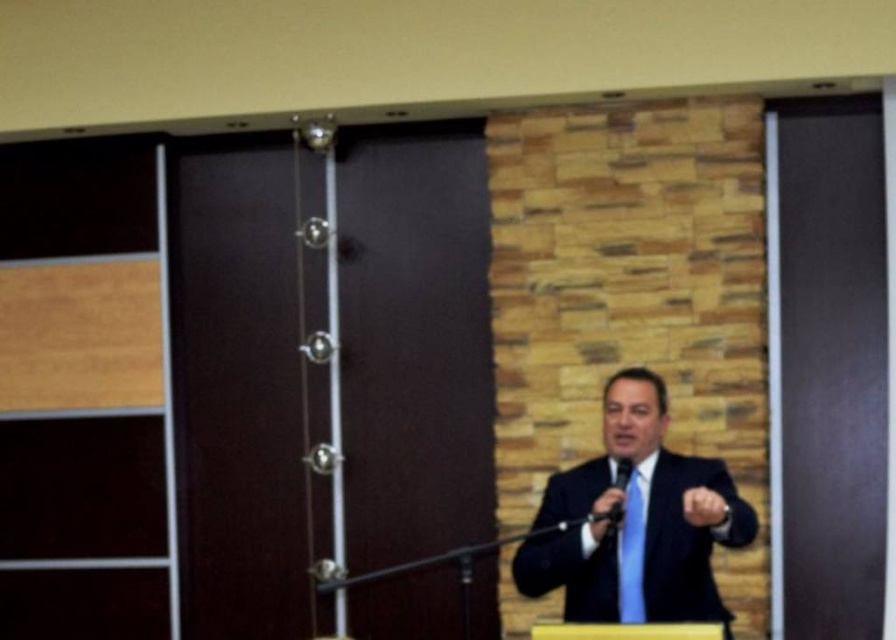
Does matte black suit at center have a greater height compared to blue silk tie at center?

Correct, matte black suit at center is much taller as blue silk tie at center.

What do you see at coordinates (636, 522) in the screenshot? I see `matte black suit at center` at bounding box center [636, 522].

Where is `matte black suit at center`? Image resolution: width=896 pixels, height=640 pixels. matte black suit at center is located at coordinates (636, 522).